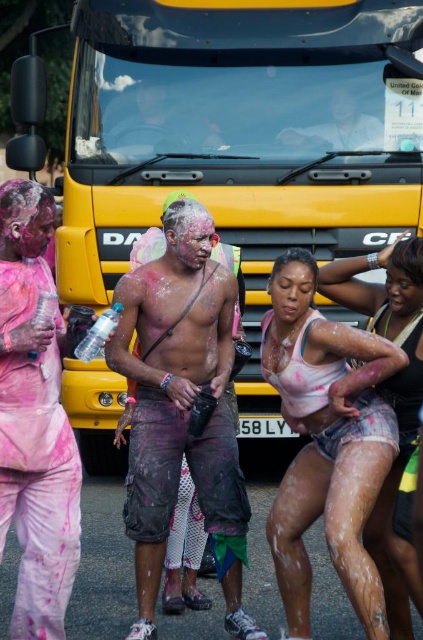
Question: Which of the following is the closest to the observer?

Choices:
 (A) pink matte pants at left
 (B) dirty cargo shorts at center
 (C) matte black camera at center
 (D) matte black shirt at upper center

Answer: (A)

Question: Is yellow matte bus at center positioned in front of matte black camera at center?

Choices:
 (A) no
 (B) yes

Answer: (B)

Question: Considering the real-world distances, which object is farthest from the yellow matte bus at center?

Choices:
 (A) matte black camera at center
 (B) matte black shirt at upper center
 (C) pink matte pants at left
 (D) dirty cargo shorts at center

Answer: (C)

Question: Is pink matte pants at left wider than matte black camera at center?

Choices:
 (A) yes
 (B) no

Answer: (B)

Question: Which point appears farthest from the camera in this image?

Choices:
 (A) (35, 388)
 (B) (123, 113)

Answer: (B)

Question: Is matte pink shorts at center to the left of matte black shirt at upper center from the viewer's perspective?

Choices:
 (A) yes
 (B) no

Answer: (B)